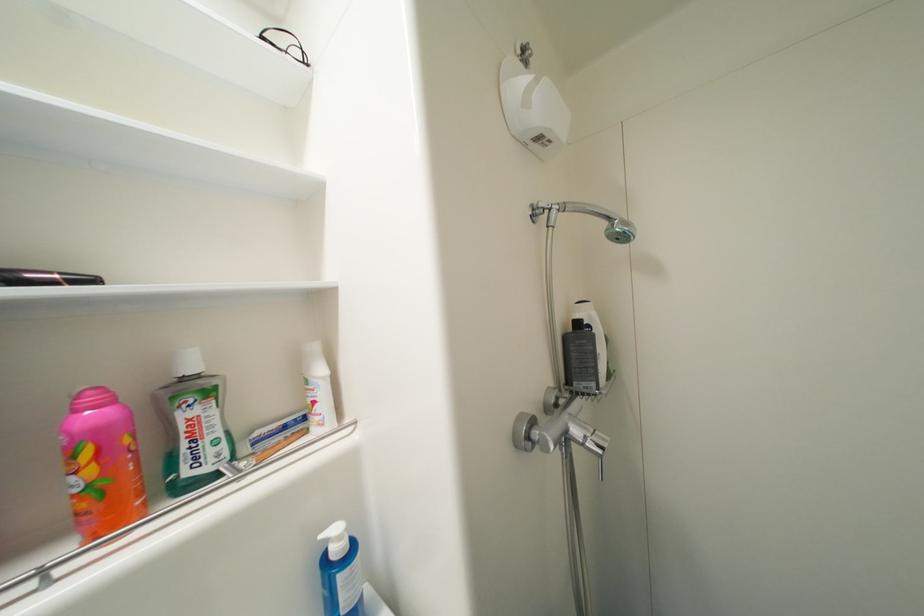
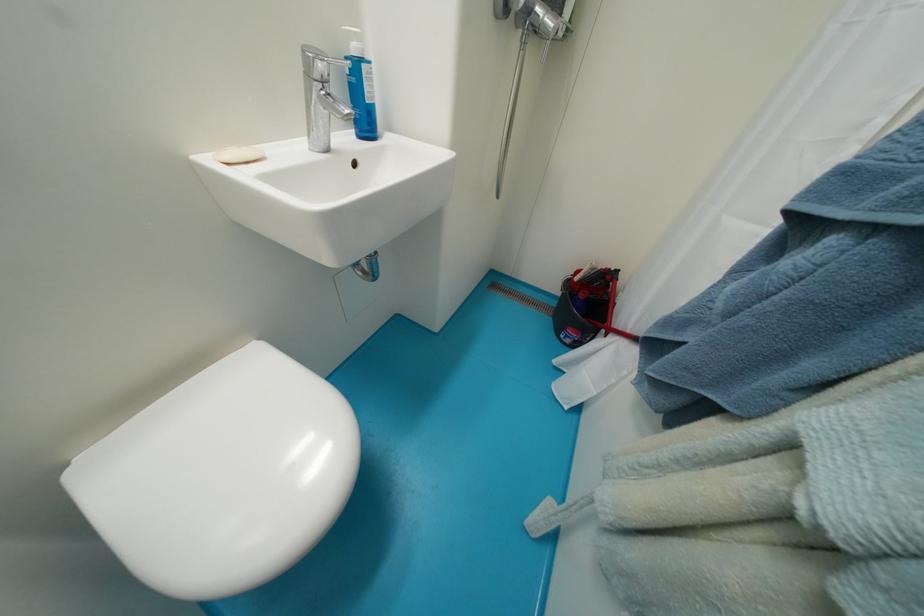
The point at (347, 578) is marked in the first image. Where is the corresponding point in the second image?

(371, 70)